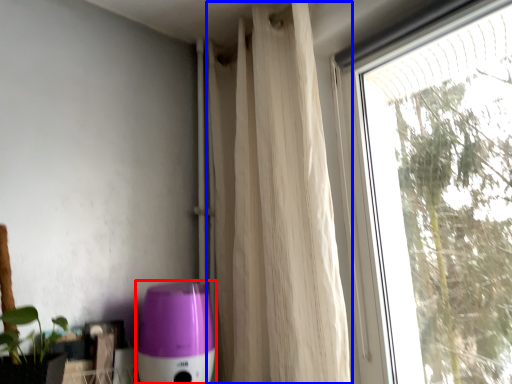
Question: Which point is closer to the camera, appliance (highlighted by a red box) or curtain (highlighted by a blue box)?

Choices:
 (A) appliance
 (B) curtain

Answer: (B)